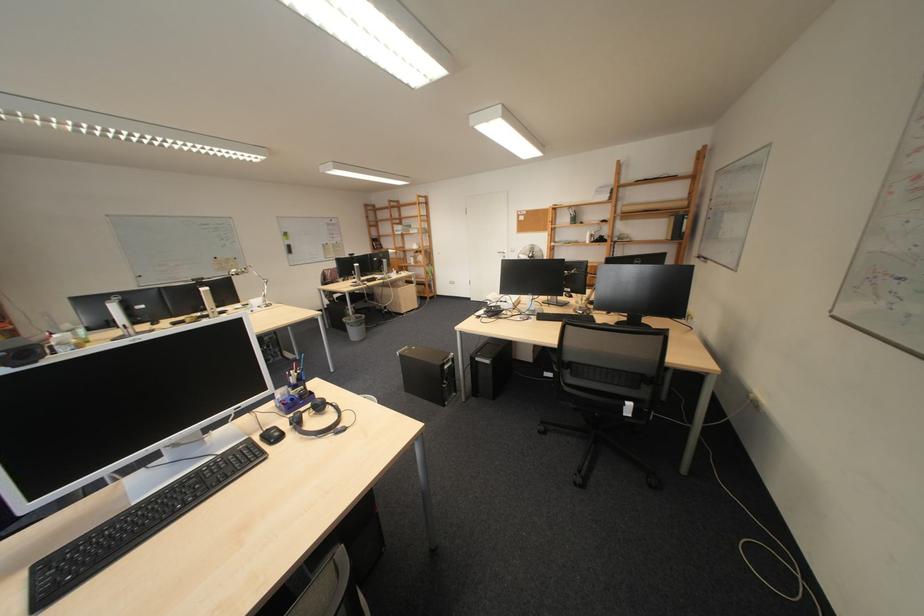
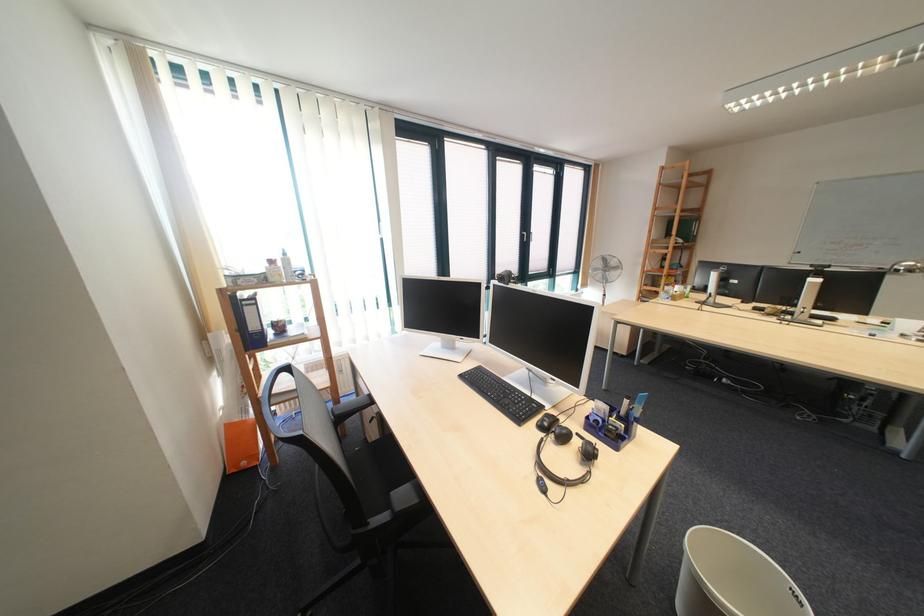
In the second image, find the point that corresponds to (x=306, y=400) in the first image.

(611, 423)